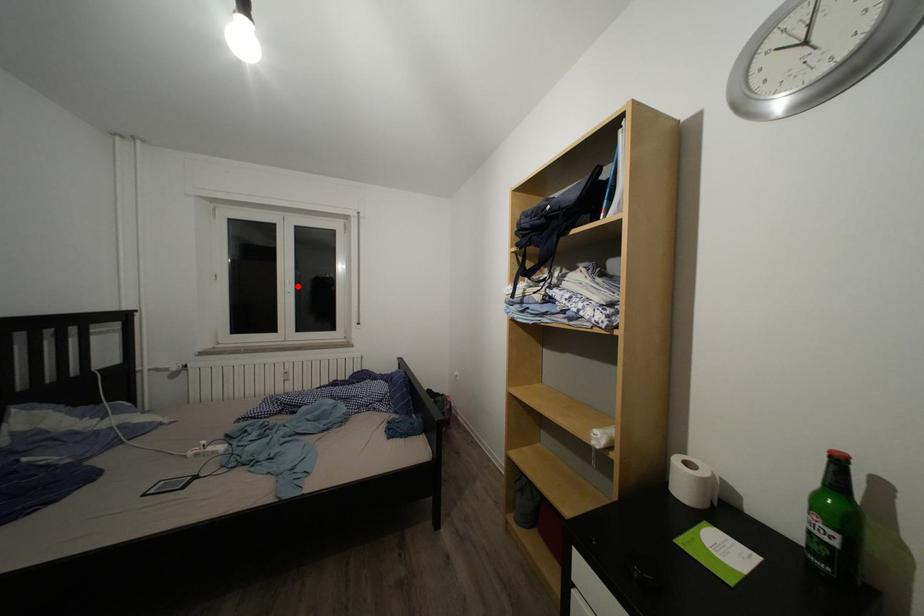
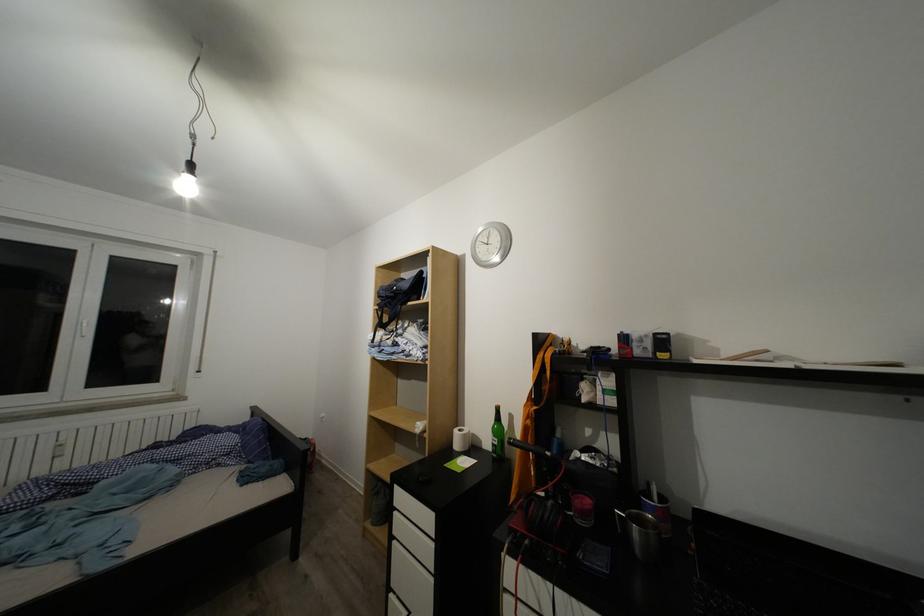
Where in the second image is the point corresponding to the highlighted location from the first image?

(90, 325)